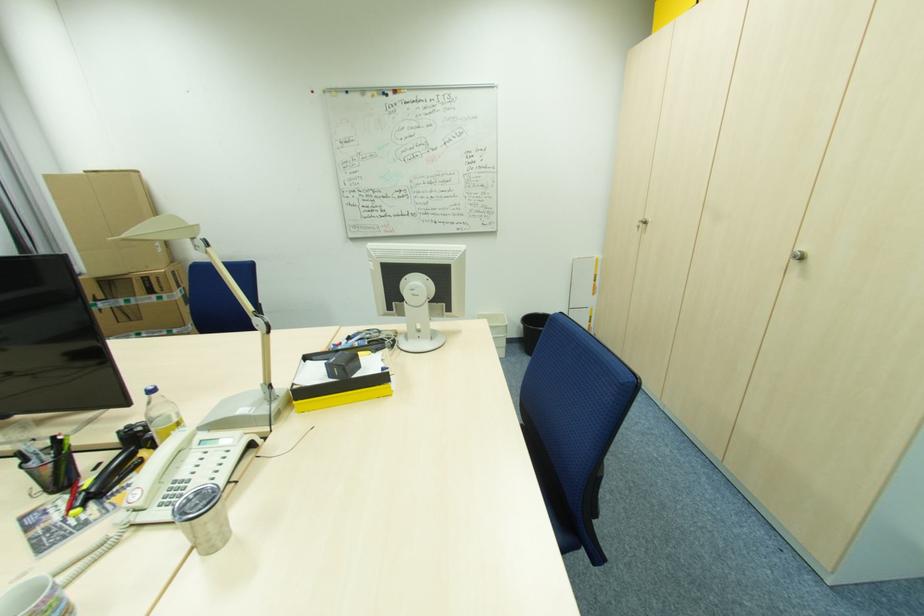
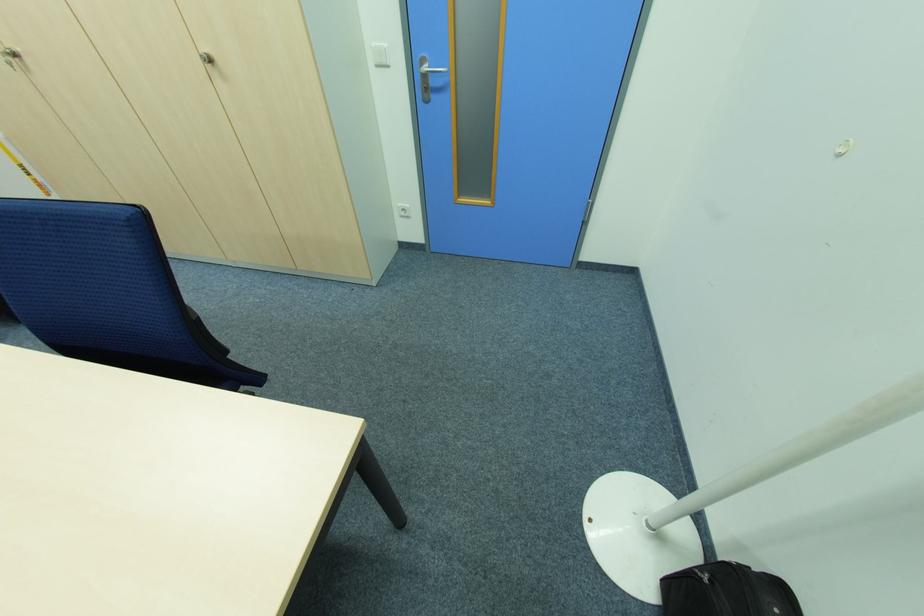
Find the pixel in the second image that matches (804,257) in the first image.

(213, 62)